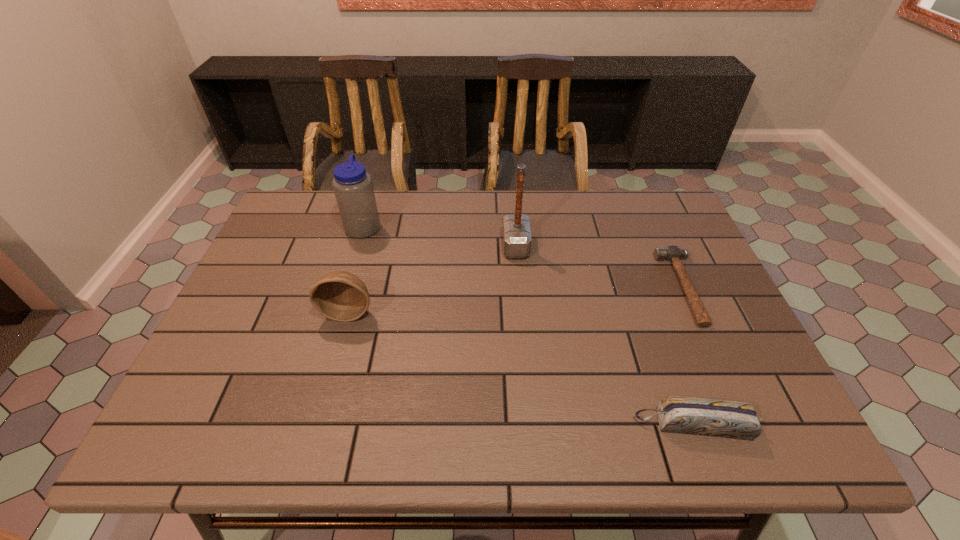
Identify the location of the third object from left to right. (517, 239).

At what (x,y) coordinates should I click in order to perform the action: click on the left hammer. Please return your answer as a coordinate pair (x, y). The height and width of the screenshot is (540, 960). Looking at the image, I should click on (517, 239).

Where is `water bottle`? The height and width of the screenshot is (540, 960). water bottle is located at coordinates (352, 185).

In order to click on bowl in this screenshot , I will do `click(341, 296)`.

In order to click on the fourth tallest object in this screenshot , I will do `click(730, 419)`.

At what (x,y) coordinates should I click in order to perform the action: click on pencil box. Please return your answer as a coordinate pair (x, y). Image resolution: width=960 pixels, height=540 pixels. Looking at the image, I should click on coord(730,419).

Where is `the shortest object`? Image resolution: width=960 pixels, height=540 pixels. the shortest object is located at coordinates (672, 253).

You are a GUI agent. You are given a task and a screenshot of the screen. Output one action in this format:
    pyautogui.click(x=<x>, y=<y>)
    Task: Click on the right hammer
    The image size is (960, 540).
    Given the screenshot: What is the action you would take?
    pyautogui.click(x=672, y=253)

Where is `blank space located on the striking surface of the taller hammer`? This screenshot has height=540, width=960. blank space located on the striking surface of the taller hammer is located at coordinates (407, 246).

Where is `free space located on the striking surface of the taller hammer`? free space located on the striking surface of the taller hammer is located at coordinates (435, 246).